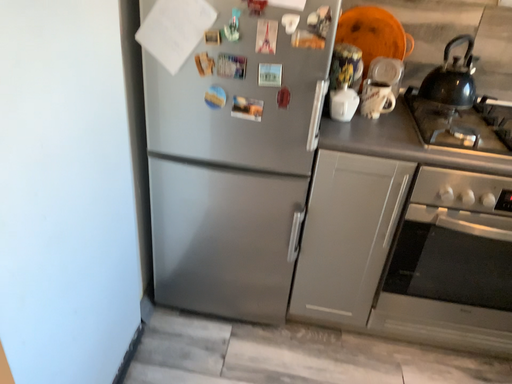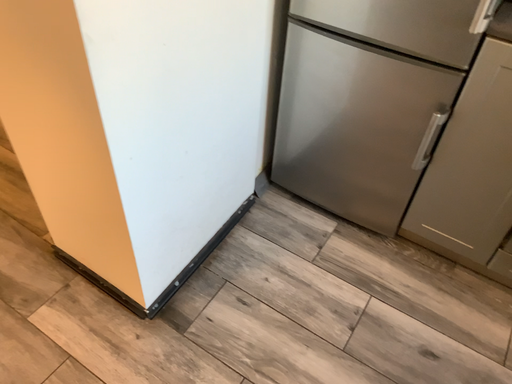
Question: How did the camera likely rotate when shooting the video?

Choices:
 (A) rotated upward
 (B) rotated downward

Answer: (B)